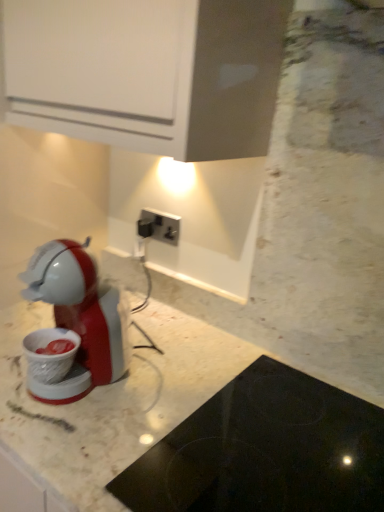
This screenshot has width=384, height=512. What do you see at coordinates (265, 451) in the screenshot?
I see `black glass cooktop at lower center` at bounding box center [265, 451].

Image resolution: width=384 pixels, height=512 pixels. I want to click on black glass cooktop at lower center, so click(265, 451).

This screenshot has width=384, height=512. What do you see at coordinates (159, 226) in the screenshot? I see `black plastic power plugs and sockets at center` at bounding box center [159, 226].

This screenshot has height=512, width=384. In order to click on black plastic power plugs and sockets at center in this screenshot , I will do point(159,226).

Image resolution: width=384 pixels, height=512 pixels. Identify the location of black glass cooktop at lower center. (265, 451).

Which object is positioned more to the left, black plastic power plugs and sockets at center or black glass cooktop at lower center?

black plastic power plugs and sockets at center.

Which is in front, black plastic power plugs and sockets at center or black glass cooktop at lower center?

black glass cooktop at lower center is closer to the camera.

Is point (138, 222) positioned behind point (372, 464)?

That is True.

From the image's perspective, which one is positioned lower, black plastic power plugs and sockets at center or black glass cooktop at lower center?

black glass cooktop at lower center.

From a real-world perspective, is black plastic power plugs and sockets at center below black glass cooktop at lower center?

No, from a real-world perspective, black plastic power plugs and sockets at center is not beneath black glass cooktop at lower center.

Is black plastic power plugs and sockets at center wider than black glass cooktop at lower center?

No, black plastic power plugs and sockets at center is not wider than black glass cooktop at lower center.

Considering the sizes of objects black plastic power plugs and sockets at center and black glass cooktop at lower center in the image provided, who is shorter, black plastic power plugs and sockets at center or black glass cooktop at lower center?

Standing shorter between the two is black plastic power plugs and sockets at center.

Does black plastic power plugs and sockets at center have a larger size compared to black glass cooktop at lower center?

Actually, black plastic power plugs and sockets at center might be smaller than black glass cooktop at lower center.

Based on the photo, is black plastic power plugs and sockets at center outside of black glass cooktop at lower center?

black plastic power plugs and sockets at center is positioned outside black glass cooktop at lower center.

Is black plastic power plugs and sockets at center not near black glass cooktop at lower center?

No, black plastic power plugs and sockets at center is not far from black glass cooktop at lower center.

Is black plastic power plugs and sockets at center facing away from black glass cooktop at lower center?

That's not correct — black plastic power plugs and sockets at center is not looking away from black glass cooktop at lower center.

Can you tell me how much black plastic power plugs and sockets at center and black glass cooktop at lower center differ in facing direction?

The facing directions of black plastic power plugs and sockets at center and black glass cooktop at lower center are 13.5 degrees apart.

The width and height of the screenshot is (384, 512). In the image, there is a black glass cooktop at lower center. In order to click on power plugs and sockets above it (from the image's perspective) in this screenshot , I will do (159, 226).

Considering the positions of objects black glass cooktop at lower center and black plastic power plugs and sockets at center in the image provided, who is more to the left, black glass cooktop at lower center or black plastic power plugs and sockets at center?

black plastic power plugs and sockets at center.

Which object is more forward, black glass cooktop at lower center or black plastic power plugs and sockets at center?

black glass cooktop at lower center is more forward.

Does point (208, 478) lie in front of point (139, 230)?

Yes, point (208, 478) is closer to viewer.

From the image's perspective, which one is positioned lower, black glass cooktop at lower center or black plastic power plugs and sockets at center?

black glass cooktop at lower center.

From a real-world perspective, between black glass cooktop at lower center and black plastic power plugs and sockets at center, who is vertically lower?

From a 3D spatial view, black glass cooktop at lower center is below.

Considering the relative sizes of black glass cooktop at lower center and black plastic power plugs and sockets at center in the image provided, is black glass cooktop at lower center wider than black plastic power plugs and sockets at center?

Yes.

Does black glass cooktop at lower center have a greater height compared to black plastic power plugs and sockets at center?

Yes, black glass cooktop at lower center is taller than black plastic power plugs and sockets at center.

In terms of size, does black glass cooktop at lower center appear bigger or smaller than black plastic power plugs and sockets at center?

In the image, black glass cooktop at lower center appears to be larger than black plastic power plugs and sockets at center.

Do you think black glass cooktop at lower center is within black plastic power plugs and sockets at center, or outside of it?

black glass cooktop at lower center is located beyond the bounds of black plastic power plugs and sockets at center.

Is black glass cooktop at lower center positioned far away from black plastic power plugs and sockets at center?

No, black glass cooktop at lower center is not far away from black plastic power plugs and sockets at center.

Is black glass cooktop at lower center facing away from black plastic power plugs and sockets at center?

No.

Identify the location of home appliance that is on the right side of black plastic power plugs and sockets at center. This screenshot has width=384, height=512. (265, 451).

Find the location of a particular element. The image size is (384, 512). home appliance below the black plastic power plugs and sockets at center (from the image's perspective) is located at coordinates (265, 451).

Locate an element on the screen. The height and width of the screenshot is (512, 384). home appliance on the right of black plastic power plugs and sockets at center is located at coordinates (265, 451).